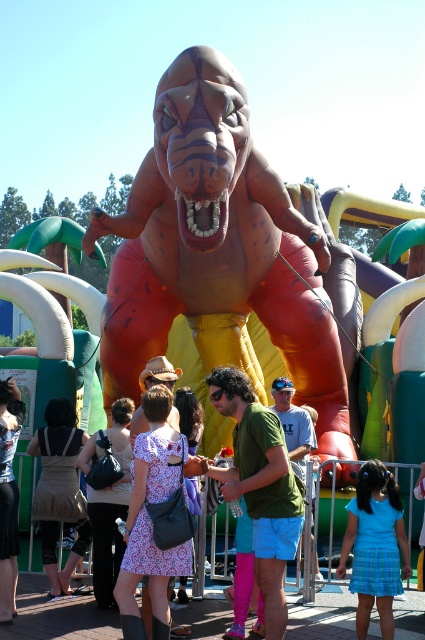
Question: Observing the image, what is the correct spatial positioning of blue plaid skirt at lower center in reference to khaki fabric skirt at center?

Choices:
 (A) above
 (B) below

Answer: (B)

Question: Can you confirm if blue plaid skirt at lower center is positioned to the left of khaki fabric skirt at center?

Choices:
 (A) yes
 (B) no

Answer: (B)

Question: Is blue plaid skirt at lower center smaller than khaki fabric skirt at center?

Choices:
 (A) no
 (B) yes

Answer: (B)

Question: Among these points, which one is nearest to the camera?

Choices:
 (A) (397, 552)
 (B) (51, 529)

Answer: (A)